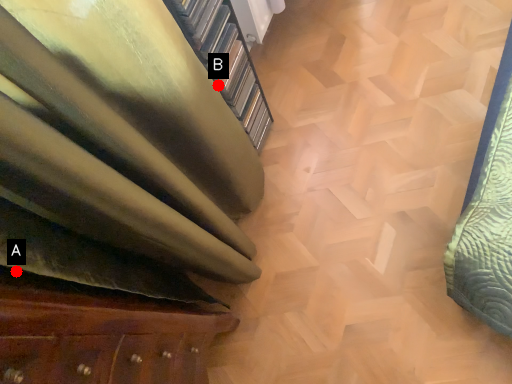
Question: Two points are circled on the image, labeled by A and B beside each circle. Which point is farther to the camera?

Choices:
 (A) A is further
 (B) B is further

Answer: (B)